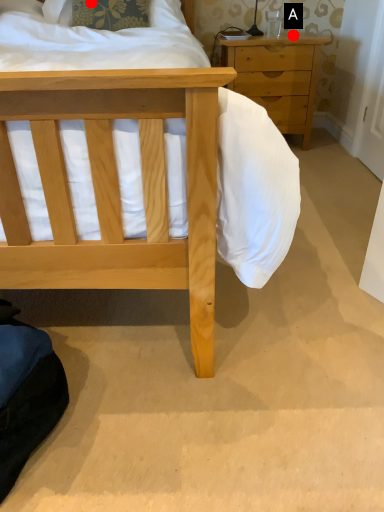
Question: Two points are circled on the image, labeled by A and B beside each circle. Which point appears closest to the camera in this image?

Choices:
 (A) A is closer
 (B) B is closer

Answer: (B)